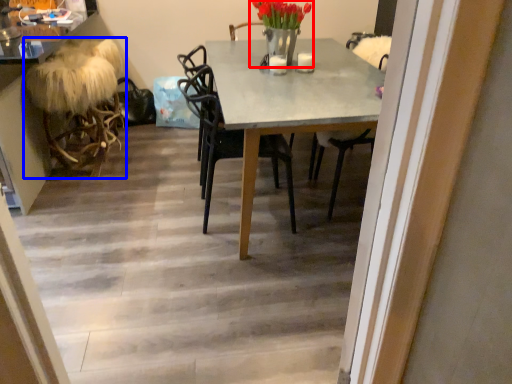
Question: Which object appears closest to the camera in this image, floral arrangement (highlighted by a red box) or rocking chair (highlighted by a blue box)?

Choices:
 (A) floral arrangement
 (B) rocking chair

Answer: (A)